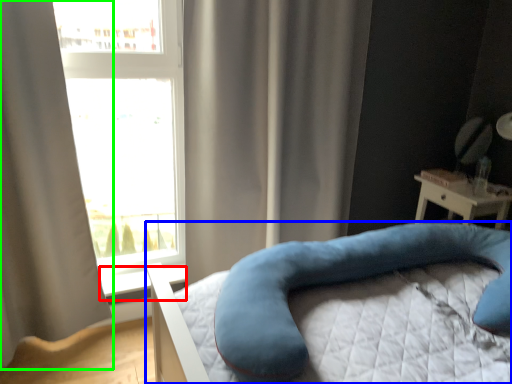
Question: Estimate the real-world distances between objects in this image. Which object is farther from window sill (highlighted by a red box), bed (highlighted by a blue box) or curtain (highlighted by a green box)?

Choices:
 (A) bed
 (B) curtain

Answer: (A)